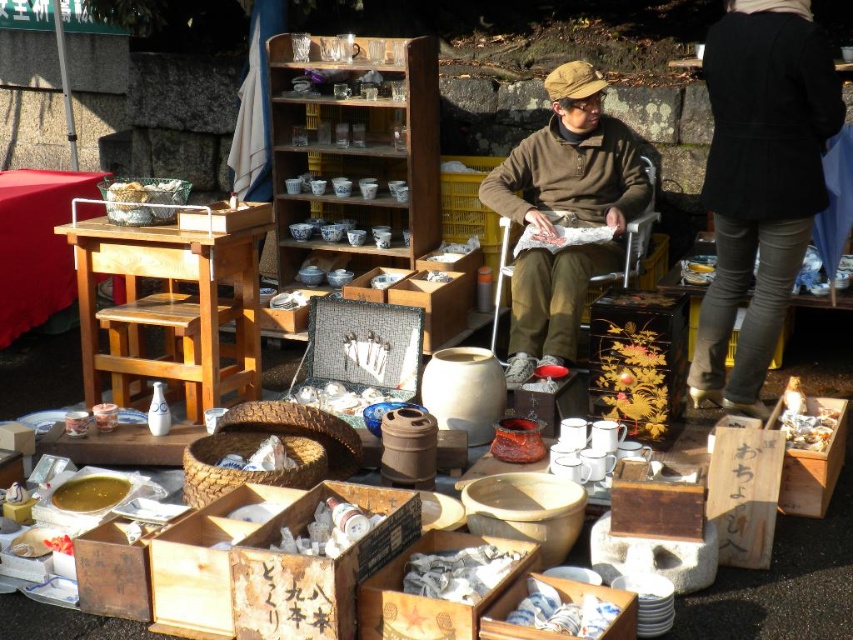
You are a customer at the flea market and want to pick up both the white paper at center and the white crumpled paper at lower right. How far apart are these two items?

The white paper at center and the white crumpled paper at lower right are 4.49 feet apart.